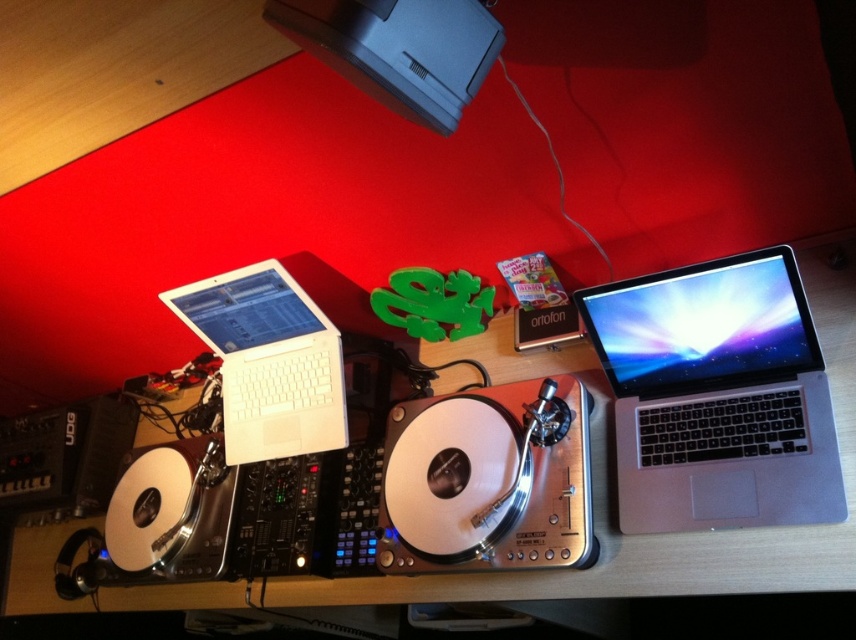
You are a DJ setting up your equipment. You have a wooden table at center and a white matte laptop at left. Where should you place your new speaker system if you want it to be between these two items?

The wooden table at center is positioned on the right side of the white matte laptop at left. Therefore, placing the speaker system between them would require positioning it to the right of the white matte laptop at left and to the left of the wooden table at center.

Based on the photo, you are a DJ setting up your equipment. You need to place a new controller between the silver metallic laptop at right and the black plastic speaker at lower left. Based on their positions, where should you position the controller?

The silver metallic laptop at right is to the right of the black plastic speaker at lower left, so you should place the new controller between them, positioning it to the right of the black plastic speaker at lower left and to the left of the silver metallic laptop at right.

In the scene shown: You are a DJ setting up your equipment. You need to place a new controller between the silver metallic laptop at right and the white matte laptop at left. Based on their positions, which laptop should you place the controller closer to?

The silver metallic laptop at right is located below the white matte laptop at left, so placing the controller closer to the silver metallic laptop at right would maintain alignment with the lower position.